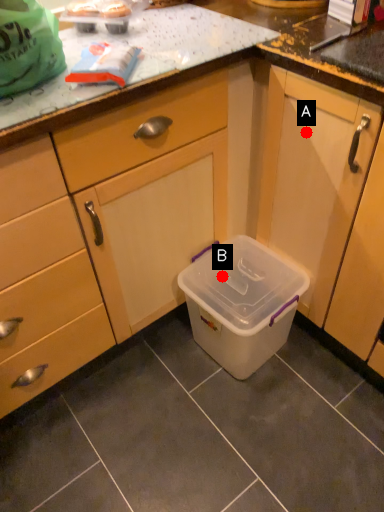
Question: Two points are circled on the image, labeled by A and B beside each circle. Which point appears farthest from the camera in this image?

Choices:
 (A) A is further
 (B) B is further

Answer: (B)